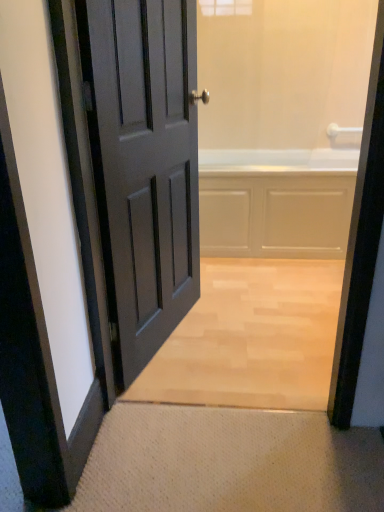
The width and height of the screenshot is (384, 512). What are the coordinates of `spots to the right of matte gray door at left` in the screenshot? It's located at (248, 351).